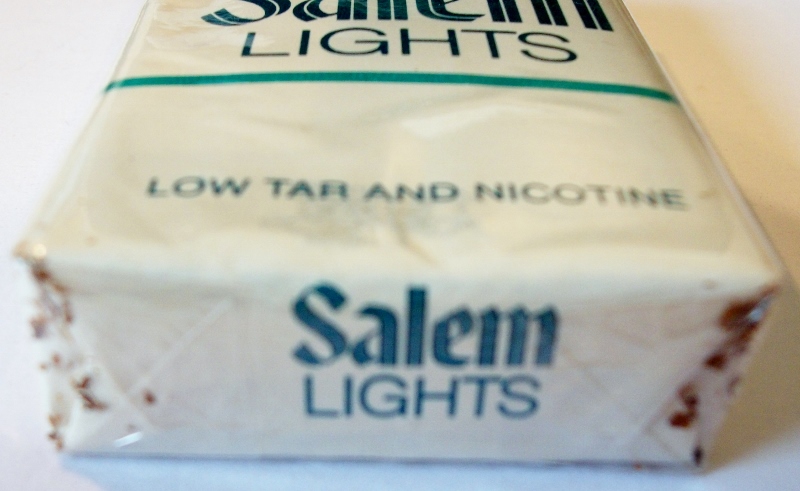
The height and width of the screenshot is (491, 800). In order to click on lights in this screenshot , I will do `click(438, 385)`.